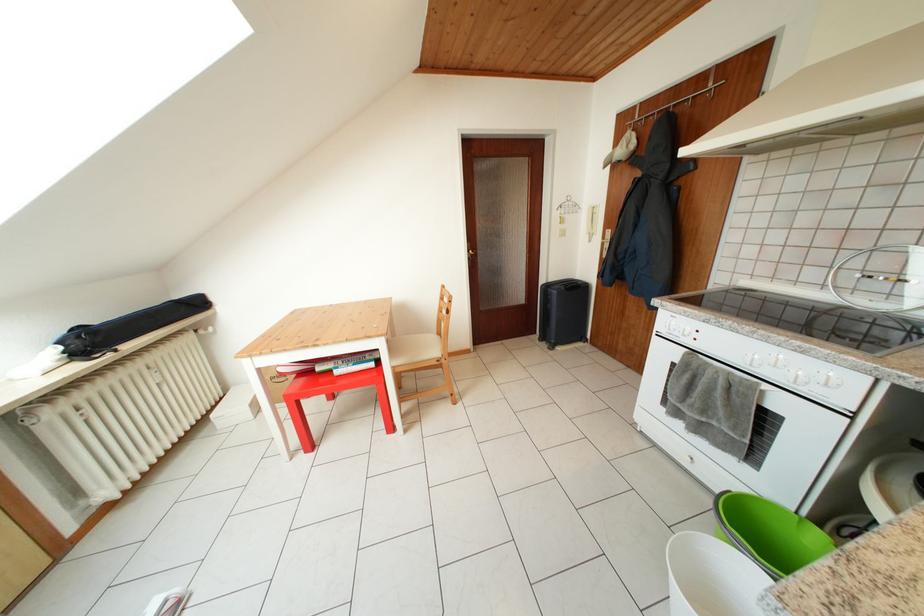
Identify the location of red stool surface. The width and height of the screenshot is (924, 616). (334, 384).